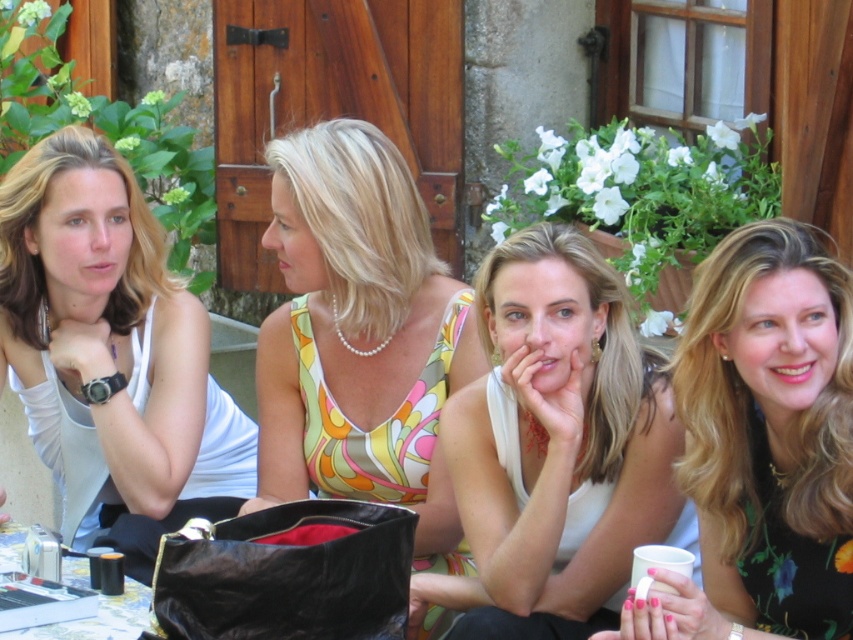
Question: Is white matte tank top at center bigger than matte floral dress at center?

Choices:
 (A) no
 (B) yes

Answer: (B)

Question: Which point is farther to the camera?

Choices:
 (A) click(x=164, y=244)
 (B) click(x=486, y=374)

Answer: (A)

Question: Which object is closer to the camera taking this photo?

Choices:
 (A) white ceramic cup at lower right
 (B) black glossy cup at lower left
 (C) metallic silver cup at lower left

Answer: (A)

Question: Can you confirm if white matte tank top at center is positioned below matte floral dress at center?

Choices:
 (A) yes
 (B) no

Answer: (A)

Question: Which object appears farthest from the camera in this image?

Choices:
 (A) black floral dress at right
 (B) black glossy cup at lower left
 (C) metallic silver cup at lower left
 (D) white matte tank top at left

Answer: (D)

Question: Does white matte tank top at left have a smaller size compared to matte floral dress at center?

Choices:
 (A) no
 (B) yes

Answer: (A)